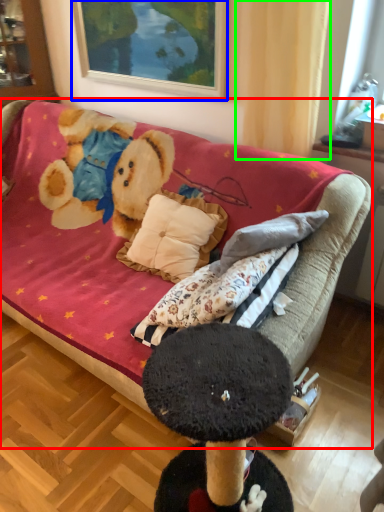
Question: Considering the real-world distances, which object is closest to studio couch (highlighted by a red box)? picture frame (highlighted by a blue box) or curtain (highlighted by a green box).

Choices:
 (A) picture frame
 (B) curtain

Answer: (B)